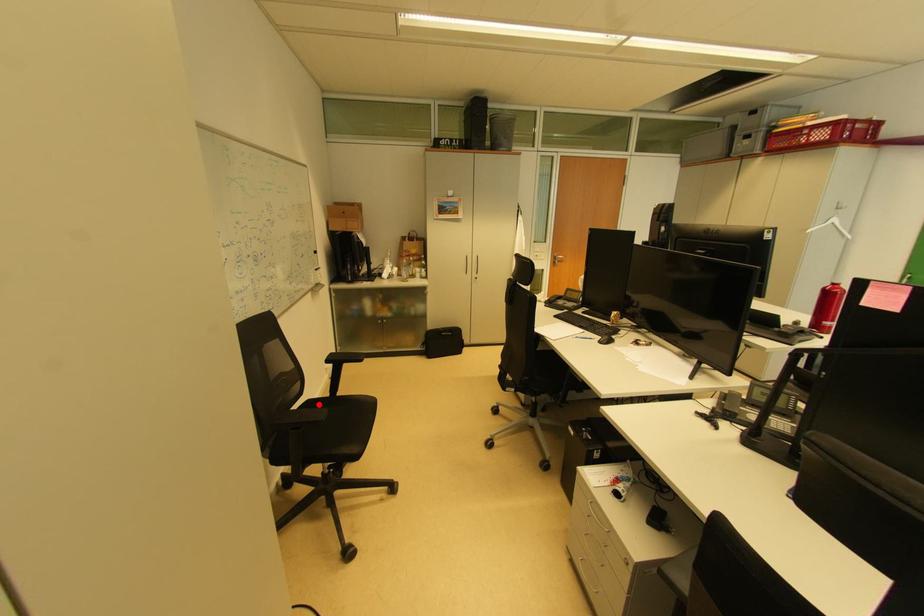
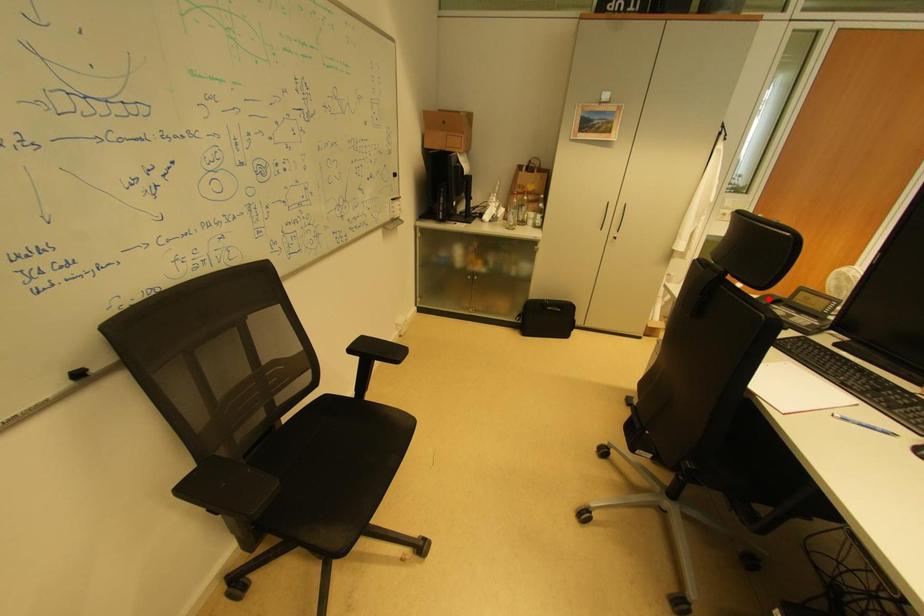
I am providing you with two images of the same scene from different viewpoints. A red point is marked on the first image and another point is marked on the second image. Does the point marked in image1 correspond to the same location as the one in image2?

No